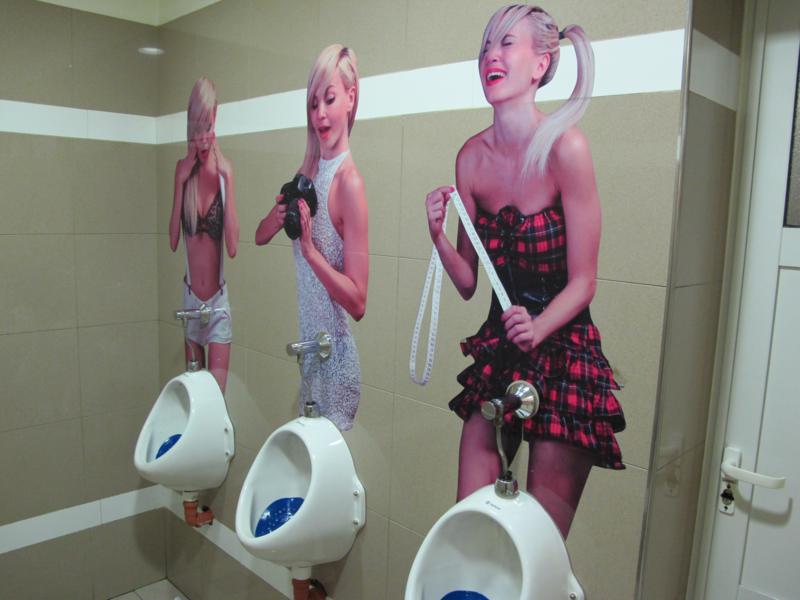
In order to click on floor in this screenshot , I will do `click(162, 588)`.